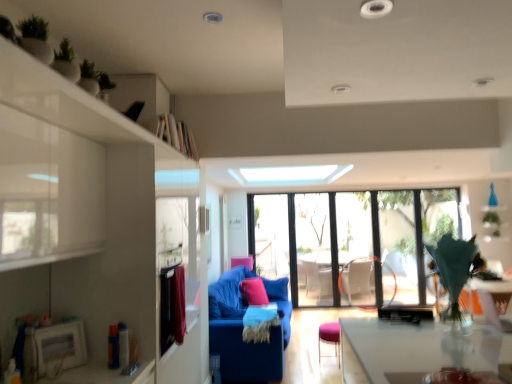
Question: Considering the relative sizes of pink fabric armchair at center and transparent glass window at center in the image provided, is pink fabric armchair at center shorter than transparent glass window at center?

Choices:
 (A) no
 (B) yes

Answer: (B)

Question: Is pink fabric armchair at center far away from transparent glass window at center?

Choices:
 (A) no
 (B) yes

Answer: (B)

Question: Can you confirm if pink fabric armchair at center is taller than transparent glass window at center?

Choices:
 (A) yes
 (B) no

Answer: (B)

Question: Considering the relative sizes of pink fabric armchair at center and transparent glass window at center in the image provided, is pink fabric armchair at center thinner than transparent glass window at center?

Choices:
 (A) yes
 (B) no

Answer: (B)

Question: From the image's perspective, does pink fabric armchair at center appear lower than transparent glass window at center?

Choices:
 (A) no
 (B) yes

Answer: (B)

Question: From a real-world perspective, is pink fabric stool at center physically located above or below pink fabric pillow at center?

Choices:
 (A) above
 (B) below

Answer: (B)

Question: Would you say pink fabric stool at center is to the left or to the right of pink fabric pillow at center in the picture?

Choices:
 (A) right
 (B) left

Answer: (A)

Question: Considering the positions of point (328, 324) and point (241, 291), is point (328, 324) closer or farther from the camera than point (241, 291)?

Choices:
 (A) farther
 (B) closer

Answer: (B)

Question: Considering their positions, is pink fabric stool at center located in front of or behind pink fabric pillow at center?

Choices:
 (A) front
 (B) behind

Answer: (A)

Question: Is point (492, 223) closer or farther from the camera than point (84, 89)?

Choices:
 (A) farther
 (B) closer

Answer: (A)

Question: From the image's perspective, is green matte plant at upper right, the 2th plant in the bottom-to-top sequence, above or below green matte plant at upper left, placed as the third plant when sorted from back to front?

Choices:
 (A) above
 (B) below

Answer: (B)

Question: From a real-world perspective, is green matte plant at upper right, which is the first plant in right-to-left order, positioned above or below green matte plant at upper left, the third plant from the right?

Choices:
 (A) below
 (B) above

Answer: (A)

Question: Would you say green matte plant at upper right, which is the first plant in right-to-left order, is to the left or to the right of green matte plant at upper left, which appears as the 1th plant when viewed from the left, in the picture?

Choices:
 (A) right
 (B) left

Answer: (A)

Question: Based on their sizes in the image, would you say green matte plant at upper left, the first plant when ordered from top to bottom, is bigger or smaller than green leafy plant in vase at right, the third plant from the top?

Choices:
 (A) big
 (B) small

Answer: (B)

Question: From the image's perspective, is green matte plant at upper left, the first plant when ordered from top to bottom, located above or below green leafy plant in vase at right, which is the first plant from bottom to top?

Choices:
 (A) below
 (B) above

Answer: (B)